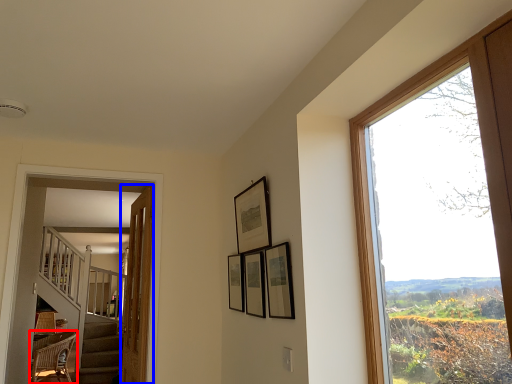
Question: Which point is closer to the camera, chair (highlighted by a red box) or door (highlighted by a blue box)?

Choices:
 (A) chair
 (B) door

Answer: (B)